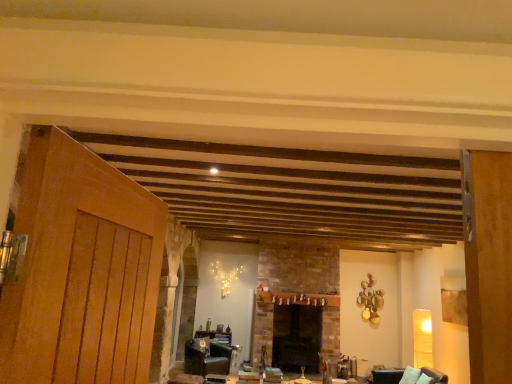
Question: Is dark brick fireplace at center next to dark brown leather armchair at lower right and touching it?

Choices:
 (A) yes
 (B) no

Answer: (B)

Question: Is dark brick fireplace at center to the left of dark brown leather armchair at lower right from the viewer's perspective?

Choices:
 (A) no
 (B) yes

Answer: (B)

Question: Can you confirm if dark brick fireplace at center is bigger than dark brown leather armchair at lower right?

Choices:
 (A) yes
 (B) no

Answer: (A)

Question: From a real-world perspective, is dark brick fireplace at center on top of dark brown leather armchair at lower right?

Choices:
 (A) yes
 (B) no

Answer: (A)

Question: From a real-world perspective, is dark brick fireplace at center beneath dark brown leather armchair at lower right?

Choices:
 (A) yes
 (B) no

Answer: (B)

Question: From a real-world perspective, is matte black armchair at lower left above or below dark brown leather armchair at lower right?

Choices:
 (A) above
 (B) below

Answer: (B)

Question: From the image's perspective, is matte black armchair at lower left above or below dark brown leather armchair at lower right?

Choices:
 (A) below
 (B) above

Answer: (A)

Question: Considering their positions, is matte black armchair at lower left located in front of or behind dark brown leather armchair at lower right?

Choices:
 (A) behind
 (B) front

Answer: (A)

Question: In terms of height, does matte black armchair at lower left look taller or shorter compared to dark brown leather armchair at lower right?

Choices:
 (A) tall
 (B) short

Answer: (A)

Question: Is dark brown leather armchair at lower right to the left or to the right of wooden table at center in the image?

Choices:
 (A) left
 (B) right

Answer: (B)

Question: Is dark brown leather armchair at lower right wider or thinner than wooden table at center?

Choices:
 (A) thin
 (B) wide

Answer: (B)

Question: Do you think dark brown leather armchair at lower right is within wooden table at center, or outside of it?

Choices:
 (A) inside
 (B) outside

Answer: (B)

Question: Considering their positions, is dark brown leather armchair at lower right located in front of or behind wooden table at center?

Choices:
 (A) front
 (B) behind

Answer: (A)

Question: From the image's perspective, is dark brick fireplace at center above or below dark brown leather armchair at lower right?

Choices:
 (A) below
 (B) above

Answer: (A)

Question: From a real-world perspective, is dark brick fireplace at center above or below dark brown leather armchair at lower right?

Choices:
 (A) above
 (B) below

Answer: (A)